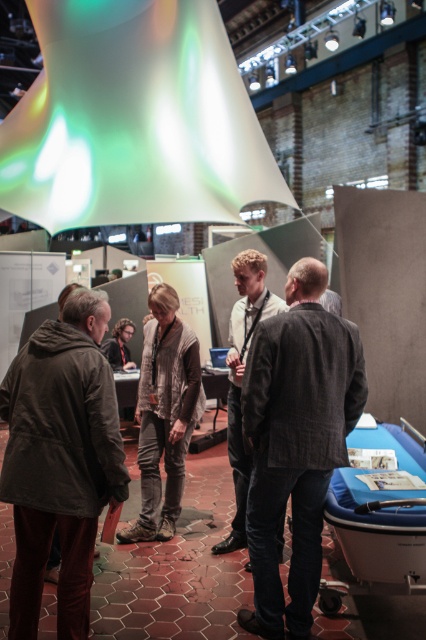
In the scene shown: Is dark gray textured jacket at center below light brown leather jacket at center?

Yes.

Looking at this image, is dark gray textured jacket at center above light brown leather jacket at center?

No, dark gray textured jacket at center is not above light brown leather jacket at center.

Where is `dark gray textured jacket at center`? dark gray textured jacket at center is located at coordinates (296, 442).

How distant is brown fabric jacket at left from light brown leather jacket at center?

brown fabric jacket at left and light brown leather jacket at center are 1.28 meters apart from each other.

Is point (78, 554) behind point (261, 253)?

No, (78, 554) is closer to viewer.

Where is `brown fabric jacket at left`? The image size is (426, 640). brown fabric jacket at left is located at coordinates click(x=60, y=460).

Does brown fabric jacket at left have a greater width compared to dark gray textured jacket at center?

Correct, the width of brown fabric jacket at left exceeds that of dark gray textured jacket at center.

Does brown fabric jacket at left appear under dark gray textured jacket at center?

No.

You are a GUI agent. You are given a task and a screenshot of the screen. Output one action in this format:
    pyautogui.click(x=<x>, y=<y>)
    Task: Click on the brown fabric jacket at left
    This screenshot has width=426, height=640.
    Given the screenshot: What is the action you would take?
    coord(60,460)